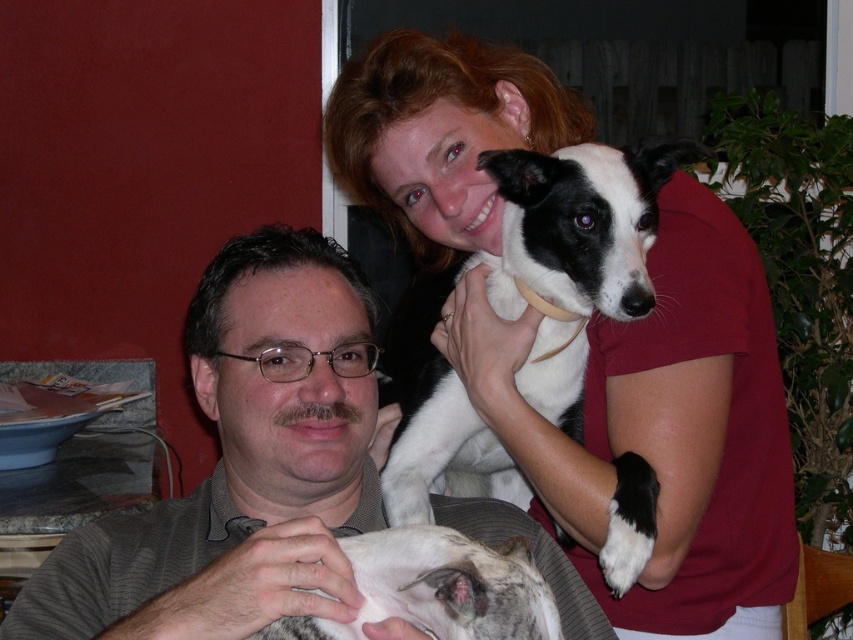
You are standing in the room and notice the black and white fur at upper center. Based on its position, can you determine if it is closer to the man holding the small dog or the woman with reddish brown hair?

The black and white fur at upper center is located at point (523, 310), which places it closer to the man holding the small dog than the woman with reddish brown hair.

You are a photographer who wants to capture a clear shot of the gray striped shirt at center and the black and white fur at upper center. Which object is closer to the camera?

The gray striped shirt at center is closer to the camera because it is in front of the black and white fur at upper center.

You are a photographer setting up for a family portrait. You need to position the gray striped shirt at center and the speckled fur dog at lower center in the frame. According to the scene description, which object is positioned to the left of the other?

The gray striped shirt at center is to the left of the speckled fur dog at lower center.